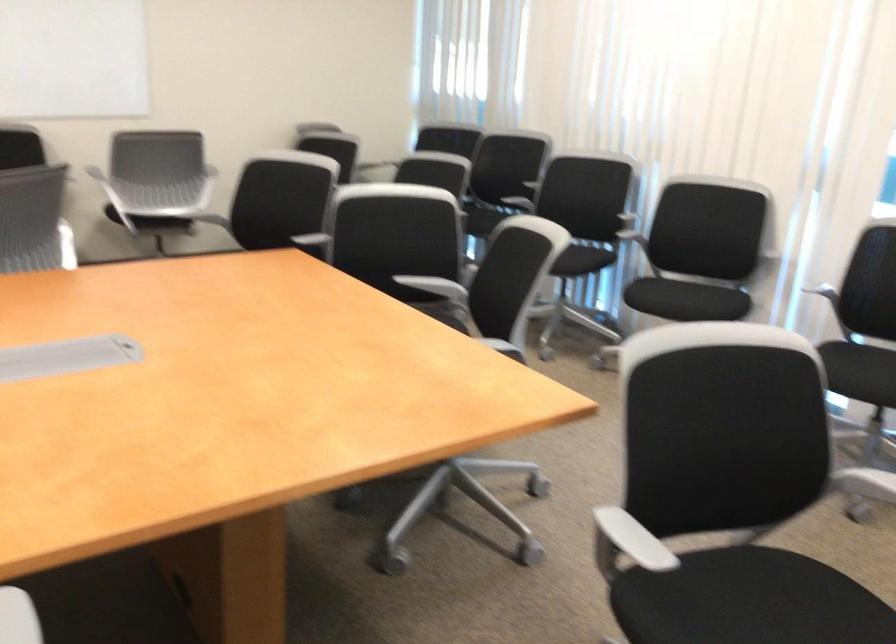
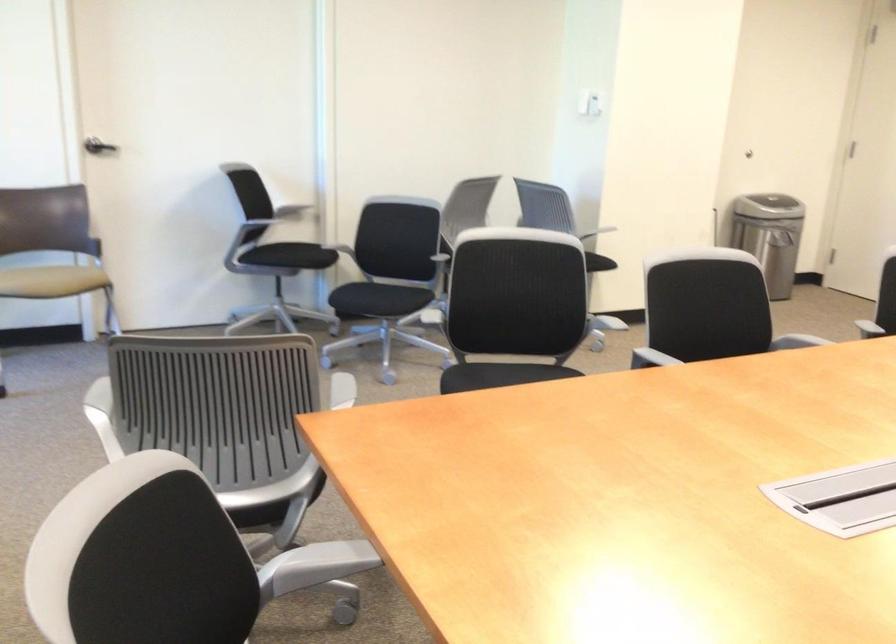
Where in the second image is the point corresponding to the point at 444,339 from the first image?

(320, 562)